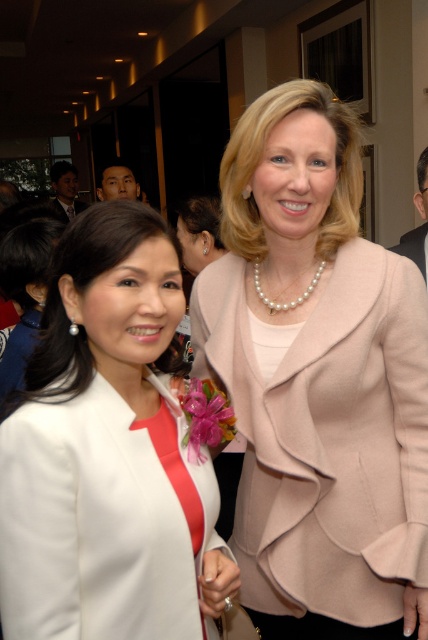
You are standing in the hallway where the two women are talking. You need to place a small decoration exactly at the point that is closer to you. Which point should you choose between point (x=109, y=237) and point (x=119, y=195)?

Point (x=109, y=237) is closer to the camera than point (x=119, y=195), so you should choose point (x=109, y=237) to place the small decoration.

You are standing in the hallway where the two women are talking. You need to reach a specific point marked at coordinates point (130, 604). If you are currently 5 feet away from this point, how many more inches do you need to move forward to be exactly at the point?

The point (130, 604) is 32.71 inches from the viewer. Since you are currently 5 feet away, which is 60 inches, you need to move back 27.29 inches to reach the point.

You are a photographer at a formal event. You need to capture a photo of the white satin blazer at center and the matte black face at upper left in the same frame. Can you fit both objects into the frame without moving your camera position?

The white satin blazer at center might be wider than matte black face at upper left, so it depends on the camera frame size. If the frame can accommodate the width of the white satin blazer at center, then both can fit.